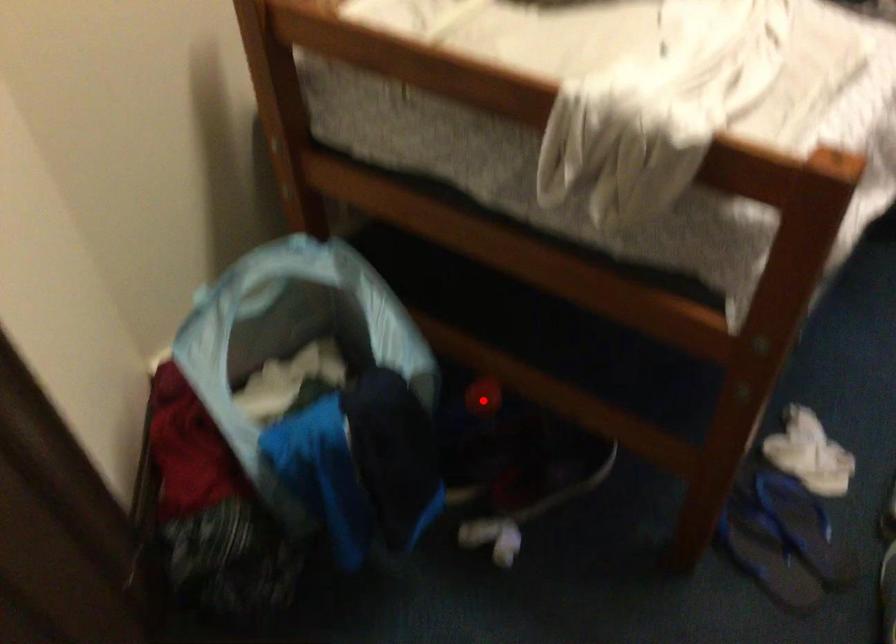
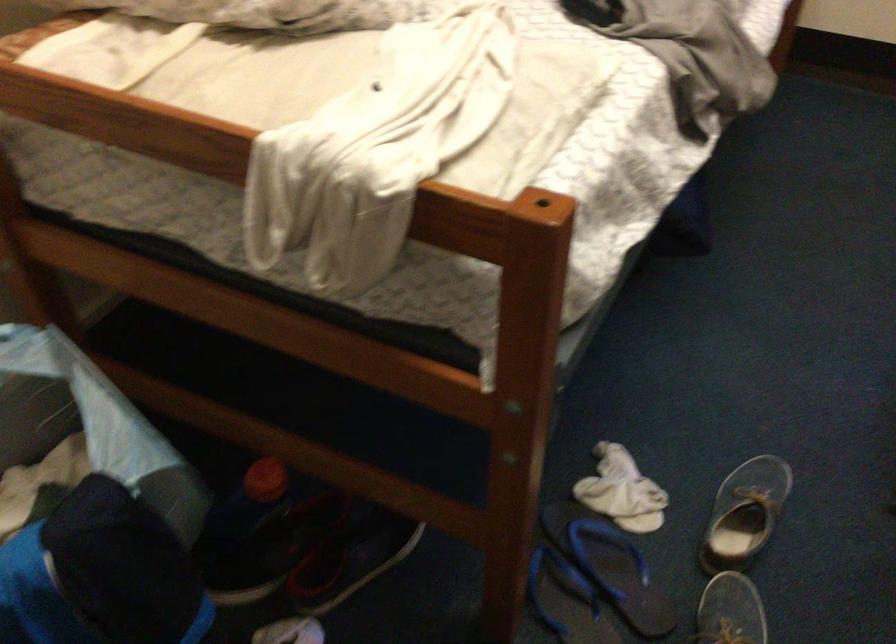
Question: I am providing you with two images of the same scene from different viewpoints. A red point is marked on the first image. At the location where the point appears in image 1, is it still visible in image 2?

Choices:
 (A) Yes
 (B) No

Answer: (A)